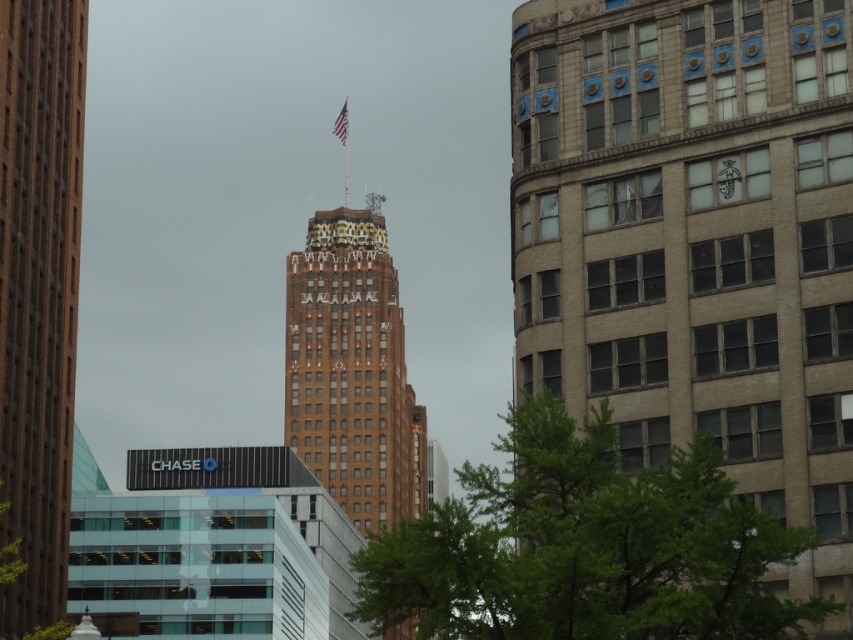
Is brown stone building at center above red fabric flag at upper center?

Incorrect, brown stone building at center is not positioned above red fabric flag at upper center.

Which is in front, point (749, 45) or point (341, 113)?

Point (749, 45)

Is point (728, 387) positioned behind point (335, 118)?

No, (728, 387) is closer to viewer.

At what (x,y) coordinates should I click in order to perform the action: click on brown stone building at center. Please return your answer as a coordinate pair (x, y). The width and height of the screenshot is (853, 640). Looking at the image, I should click on (695, 241).

Can you confirm if brown stone building at center is positioned to the right of brown brick tower at center?

Correct, you'll find brown stone building at center to the right of brown brick tower at center.

Who is more forward, (550, 200) or (45, 609)?

Point (550, 200)

Locate an element on the screen. brown stone building at center is located at coordinates (695, 241).

Is green leafy tree at center below brown brick building at center?

No, green leafy tree at center is not below brown brick building at center.

Does green leafy tree at center have a smaller size compared to brown brick building at center?

Indeed, green leafy tree at center has a smaller size compared to brown brick building at center.

Find the location of `green leafy tree at center`. green leafy tree at center is located at coordinates (585, 547).